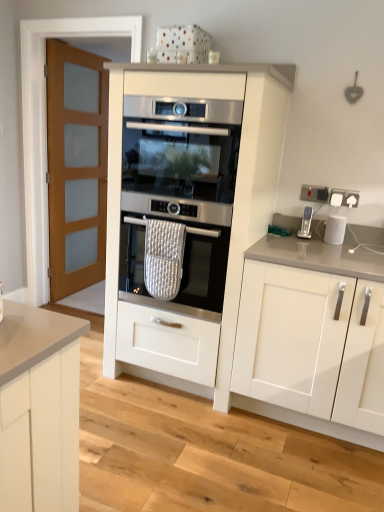
Question: Looking at their shapes, would you say white matte cabinet at right, the 1th cabinetry in the right-to-left sequence, is wider or thinner than satin silver oven at center, placed as the second oven when sorted from top to bottom?

Choices:
 (A) thin
 (B) wide

Answer: (B)

Question: Is white matte cabinet at right, the 1th cabinetry in the right-to-left sequence, situated inside satin silver oven at center, placed as the second oven when sorted from top to bottom, or outside?

Choices:
 (A) inside
 (B) outside

Answer: (B)

Question: Based on their relative distances, which object is farther from the stainless steel oven at center, arranged as the 1th oven when viewed from the top?

Choices:
 (A) white glossy kettle at upper right
 (B) white matte cabinet at right, the 2th cabinetry from the left
 (C) satin silver oven at center, the 1th oven positioned from the bottom
 (D) white matte oven at center, the 1th cabinetry when ordered from left to right
 (E) satin silver water dispenser at right

Answer: (A)

Question: Estimate the real-world distances between objects in this image. Which object is closer to the white matte oven at center, the 1th cabinetry when ordered from left to right?

Choices:
 (A) satin silver water dispenser at right
 (B) white glossy kettle at upper right
 (C) stainless steel oven at center, arranged as the 1th oven when viewed from the top
 (D) satin silver oven at center, the 1th oven positioned from the bottom
 (E) white matte cabinet at right, the 2th cabinetry from the left

Answer: (D)